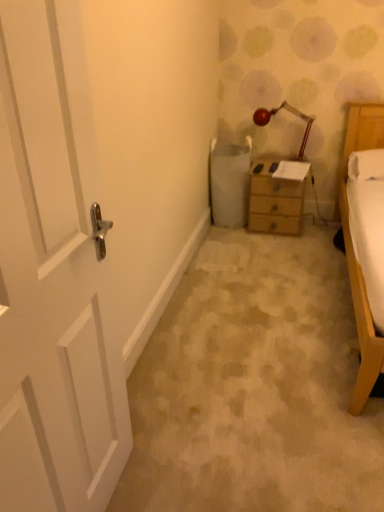
Question: From their relative heights in the image, would you say white soft pillow at right is taller or shorter than wooden nightstand at center?

Choices:
 (A) tall
 (B) short

Answer: (B)

Question: From the image's perspective, relative to wooden nightstand at center, is white soft pillow at right above or below?

Choices:
 (A) above
 (B) below

Answer: (A)

Question: Which is farther from the white wooden door at left?

Choices:
 (A) matte red lamp at upper right
 (B) white soft pillow at right
 (C) wooden nightstand at center

Answer: (A)

Question: Based on their relative distances, which object is farther from the white wooden door at left?

Choices:
 (A) white soft pillow at right
 (B) matte red lamp at upper right
 (C) wooden nightstand at center

Answer: (B)